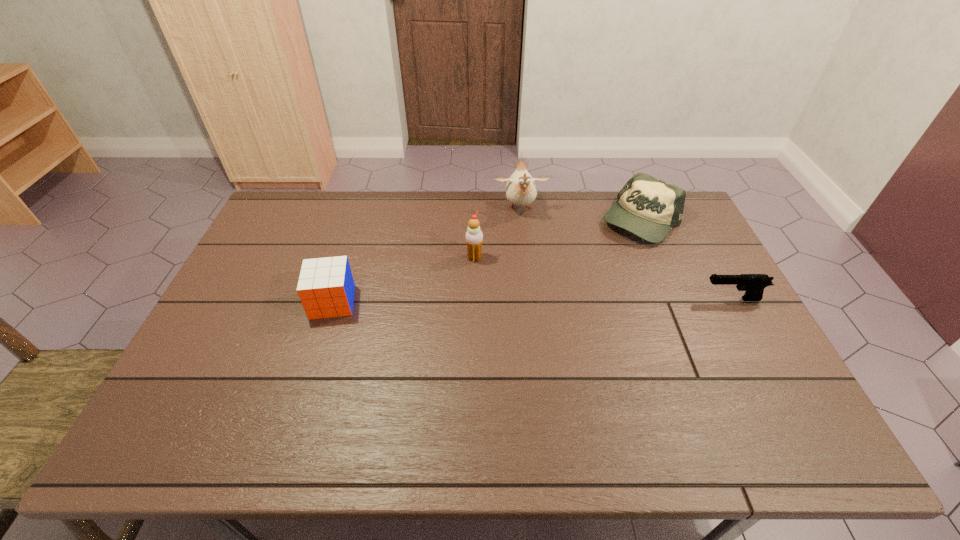
Where is `object that is the closest to the icecream`? object that is the closest to the icecream is located at coordinates (521, 190).

You are a GUI agent. You are given a task and a screenshot of the screen. Output one action in this format:
    pyautogui.click(x=<x>, y=<y>)
    Task: Click on the vacant region that satisfies the following two spatial constraints: 1. on the back side of the pistol; 2. on the front-facing side of the leftmost object
    This screenshot has width=960, height=540.
    Given the screenshot: What is the action you would take?
    pyautogui.click(x=333, y=299)

Locate an element on the screen. The image size is (960, 540). free space that satisfies the following two spatial constraints: 1. on the front side of the pistol; 2. on the front-facing side of the baseball cap is located at coordinates (674, 299).

This screenshot has width=960, height=540. I want to click on free point that satisfies the following two spatial constraints: 1. on the back side of the third object from left to right; 2. on the right side of the icecream, so click(x=475, y=209).

The image size is (960, 540). Find the location of `vacant point that satisfies the following two spatial constraints: 1. on the back side of the baseball cap; 2. on the right side of the leftmost object`. vacant point that satisfies the following two spatial constraints: 1. on the back side of the baseball cap; 2. on the right side of the leftmost object is located at coordinates (358, 220).